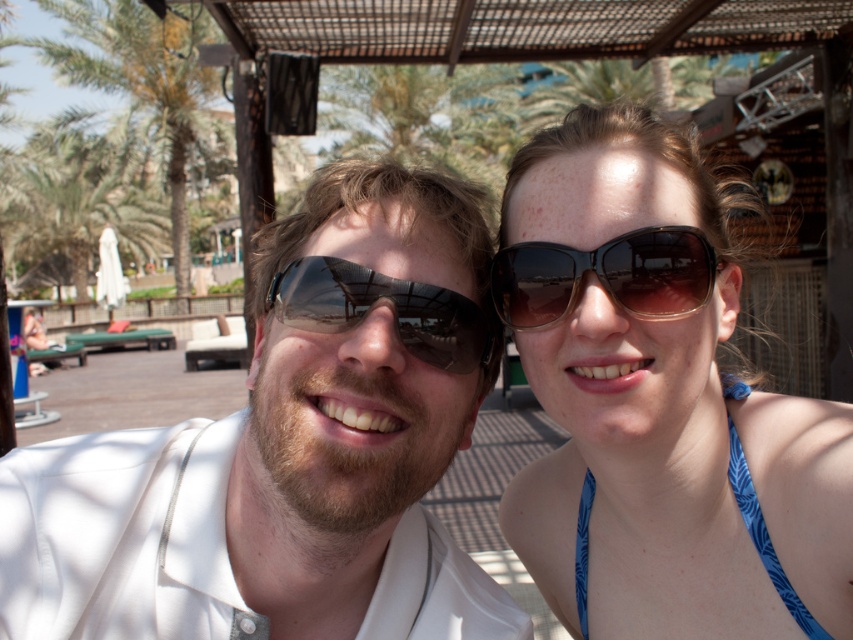
You are a photographer trying to capture the perfect shot of the brown reflective sunglasses at left and the blue printed fabric bikini top at upper right. Since you want to highlight both items clearly, which object should you focus on first to ensure proper framing given their sizes?

The brown reflective sunglasses at left is bigger than the blue printed fabric bikini top at upper right, so you should focus on the brown reflective sunglasses at left first to ensure proper framing.

You are a photographer trying to capture the two people in the selfie without any obstructions. Since the white matte sunglasses at center and the green leafy palm tree at upper left are both in the frame, which object should you adjust your focus on to ensure the people are clear and the palm tree is not blocking them?

The white matte sunglasses at center is in front of the green leafy palm tree at upper left, so focusing on the sunglasses will ensure the people are clear while the palm tree remains visible but not obstructing.